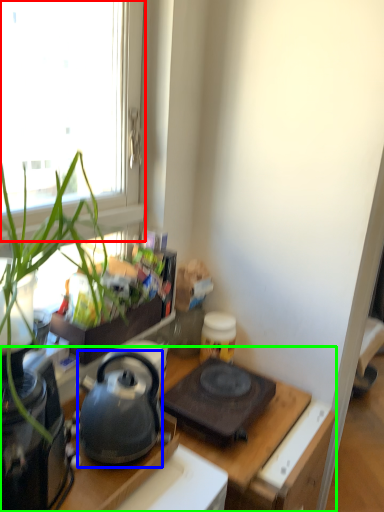
Question: Which object is the closest to the window (highlighted by a red box)? Choose among these: kettle (highlighted by a blue box) or desk (highlighted by a green box).

Choices:
 (A) kettle
 (B) desk

Answer: (A)